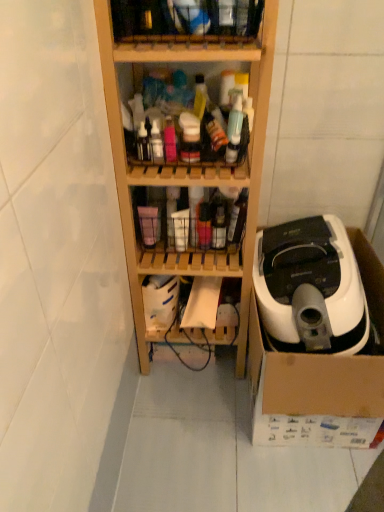
Question: Can you confirm if white plastic vacuum cleaner at right is wider than wooden shelf at center, positioned as the second shelf in bottom-to-top order?

Choices:
 (A) yes
 (B) no

Answer: (A)

Question: Can you confirm if white plastic vacuum cleaner at right is bigger than wooden shelf at center, positioned as the second shelf in bottom-to-top order?

Choices:
 (A) yes
 (B) no

Answer: (B)

Question: Is white plastic vacuum cleaner at right to the left of wooden shelf at center, positioned as the second shelf in bottom-to-top order, from the viewer's perspective?

Choices:
 (A) yes
 (B) no

Answer: (B)

Question: From a real-world perspective, is white plastic vacuum cleaner at right positioned under wooden shelf at center, which appears as the third shelf when viewed from the top, based on gravity?

Choices:
 (A) no
 (B) yes

Answer: (B)

Question: Can you see white plastic vacuum cleaner at right touching wooden shelf at center, which appears as the third shelf when viewed from the top?

Choices:
 (A) yes
 (B) no

Answer: (B)

Question: Is white plastic vacuum cleaner at right positioned before wooden shelf at center, positioned as the second shelf in bottom-to-top order?

Choices:
 (A) yes
 (B) no

Answer: (B)

Question: Can you see translucent plastic bottles at center, acting as the 4th shelf starting from the top, touching wooden shelf at center, positioned as the second shelf in bottom-to-top order?

Choices:
 (A) no
 (B) yes

Answer: (A)

Question: From the image's perspective, is translucent plastic bottles at center, acting as the 4th shelf starting from the top, on wooden shelf at center, which appears as the third shelf when viewed from the top?

Choices:
 (A) no
 (B) yes

Answer: (A)

Question: Can you confirm if translucent plastic bottles at center, acting as the 4th shelf starting from the top, is thinner than wooden shelf at center, which appears as the third shelf when viewed from the top?

Choices:
 (A) yes
 (B) no

Answer: (A)

Question: Does translucent plastic bottles at center, which is counted as the 1th shelf, starting from the bottom, have a greater width compared to wooden shelf at center, positioned as the second shelf in bottom-to-top order?

Choices:
 (A) yes
 (B) no

Answer: (B)

Question: Is the position of translucent plastic bottles at center, which is counted as the 1th shelf, starting from the bottom, more distant than that of wooden shelf at center, which appears as the third shelf when viewed from the top?

Choices:
 (A) yes
 (B) no

Answer: (A)

Question: From the image's perspective, is translucent plastic bottles at center, acting as the 4th shelf starting from the top, beneath wooden shelf at center, which appears as the third shelf when viewed from the top?

Choices:
 (A) yes
 (B) no

Answer: (A)

Question: Is wooden shelf at upper center, which is the fourth shelf in bottom-to-top order, positioned behind white plastic vacuum cleaner at right?

Choices:
 (A) no
 (B) yes

Answer: (A)